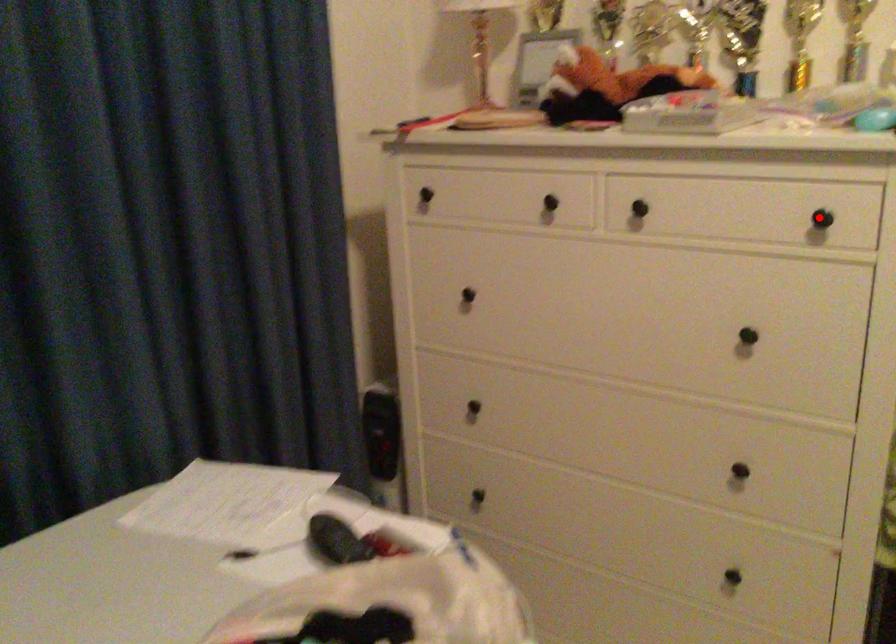
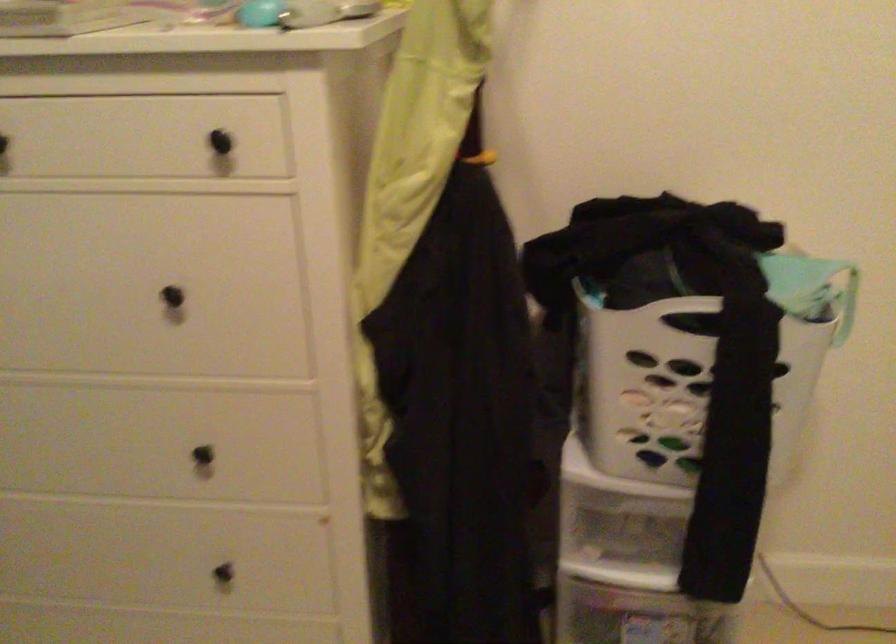
Question: I am providing you with two images of the same scene from different viewpoints. A red point is shown in image1. For the corresponding object point in image2, is it positioned nearer or farther from the camera?

Choices:
 (A) Nearer
 (B) Farther

Answer: (A)